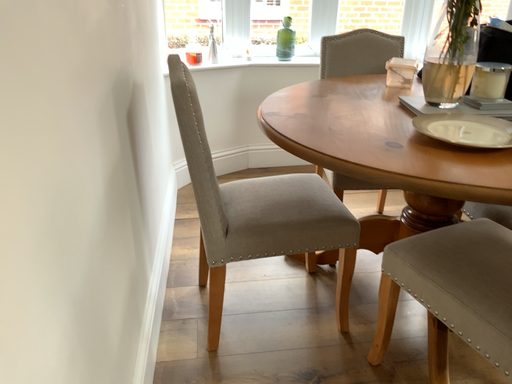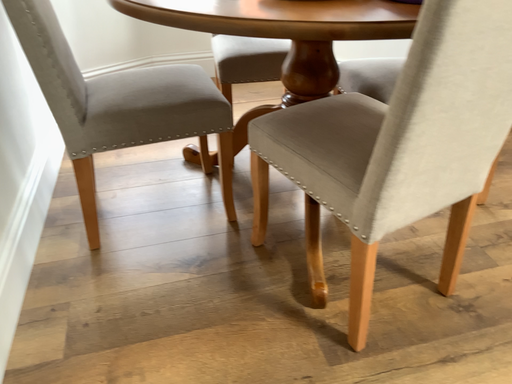
Question: How did the camera likely rotate when shooting the video?

Choices:
 (A) rotated left
 (B) rotated right

Answer: (B)